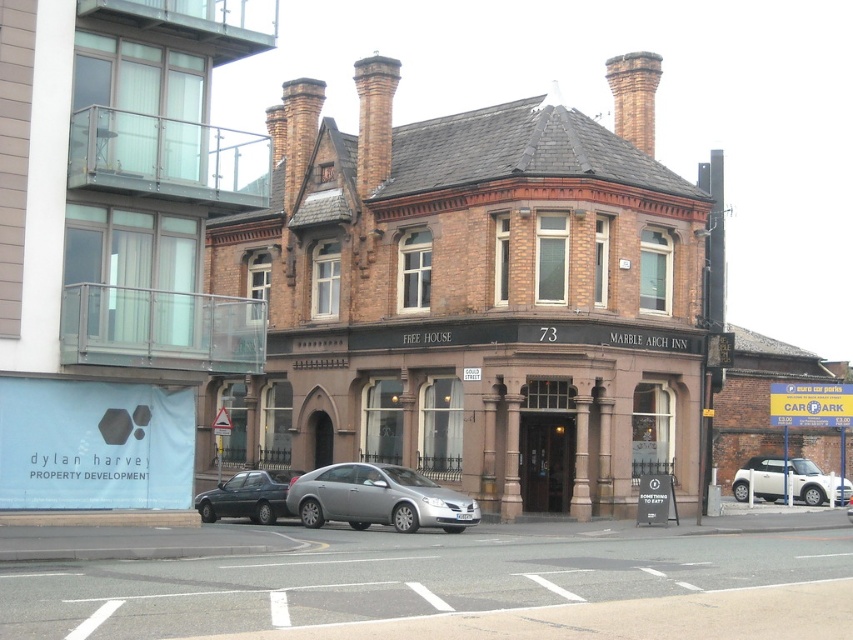
Which is above, smooth asphalt road at lower center or metallic gray sedan at lower left?

Positioned higher is smooth asphalt road at lower center.

Who is more forward, (x=376, y=536) or (x=263, y=486)?

Point (x=376, y=536) is in front.

Image resolution: width=853 pixels, height=640 pixels. Find the location of `smooth asphalt road at lower center`. smooth asphalt road at lower center is located at coordinates (428, 580).

Between smooth asphalt road at lower center and white matte car at lower right, which one has less height?

With less height is white matte car at lower right.

Can you confirm if smooth asphalt road at lower center is shorter than white matte car at lower right?

No.

Does point (663, 560) lie behind point (735, 493)?

No, (663, 560) is closer to viewer.

Locate an element on the screen. This screenshot has width=853, height=640. smooth asphalt road at lower center is located at coordinates (428, 580).

Who is shorter, brown brick building at center or white matte car at lower right?

white matte car at lower right is shorter.

This screenshot has width=853, height=640. What do you see at coordinates (474, 296) in the screenshot?
I see `brown brick building at center` at bounding box center [474, 296].

At what (x,y) coordinates should I click in order to perform the action: click on brown brick building at center. Please return your answer as a coordinate pair (x, y). Looking at the image, I should click on (474, 296).